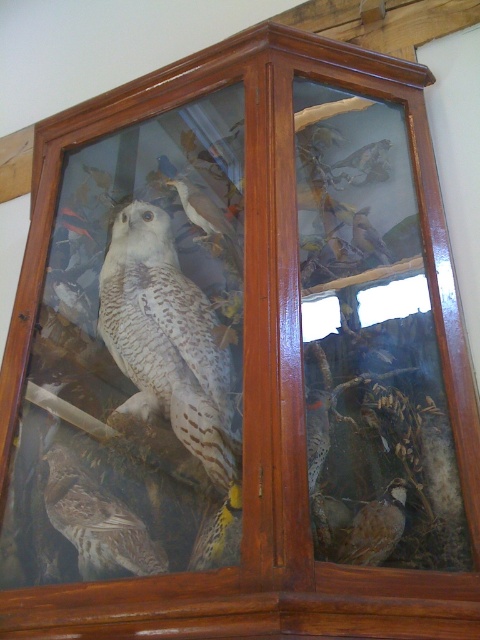
Question: Among these points, which one is nearest to the camera?

Choices:
 (A) (133, 541)
 (B) (380, 236)

Answer: (A)

Question: Estimate the real-world distances between objects in this image. Which object is closer to the speckled brown woodpecker at center?

Choices:
 (A) brown speckled feathers at upper right
 (B) yellow-green woodpecker at lower center

Answer: (B)

Question: Which of the following is the farthest from the observer?

Choices:
 (A) (327, 413)
 (B) (371, 253)
 (C) (67, 467)
 (D) (140, 355)

Answer: (B)

Question: Does brown speckled feathers at lower left appear on the right side of yellow-green woodpecker at lower center?

Choices:
 (A) no
 (B) yes

Answer: (A)

Question: Can you confirm if speckled brown woodpecker at center is positioned below brown speckled feathers at upper right?

Choices:
 (A) yes
 (B) no

Answer: (A)

Question: Does speckled white owl at center appear under yellow-green woodpecker at lower center?

Choices:
 (A) no
 (B) yes

Answer: (A)